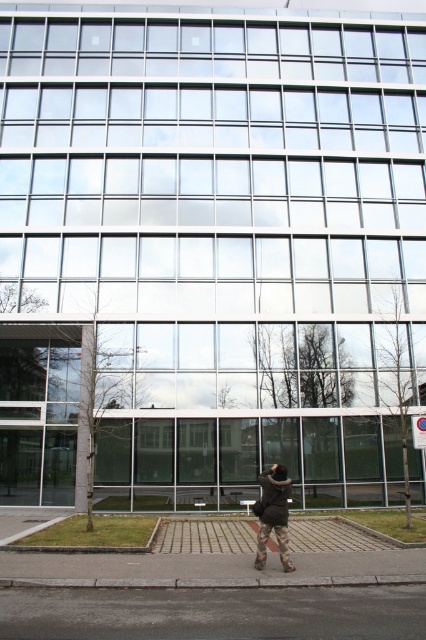
You are a delivery person trying to park your bike on the gray asphalt at lower center near the gray concrete curb at lower center. Since the curb is part of the pavement, can you fit your bike there if the bike requires 1.2 meters of space?

The gray asphalt at lower center is larger in size than the gray concrete curb at lower center, so there should be enough space to park the bike requiring 1.2 meters of space on the gray asphalt at lower center near the gray concrete curb at lower center.

Looking at this image, you are a delivery person trying to park your electric scooter. The scooter requires a minimum of 1 meter of space to park. Given that you are standing on the gray concrete curb at lower center, can you park your scooter on the gray asphalt at lower center?

The gray asphalt at lower center has a larger width than the gray concrete curb at lower center. Since the scooter needs 1 meter of space, and the asphalt is wider, it is likely that there is enough space to park the scooter on the gray asphalt at lower center.